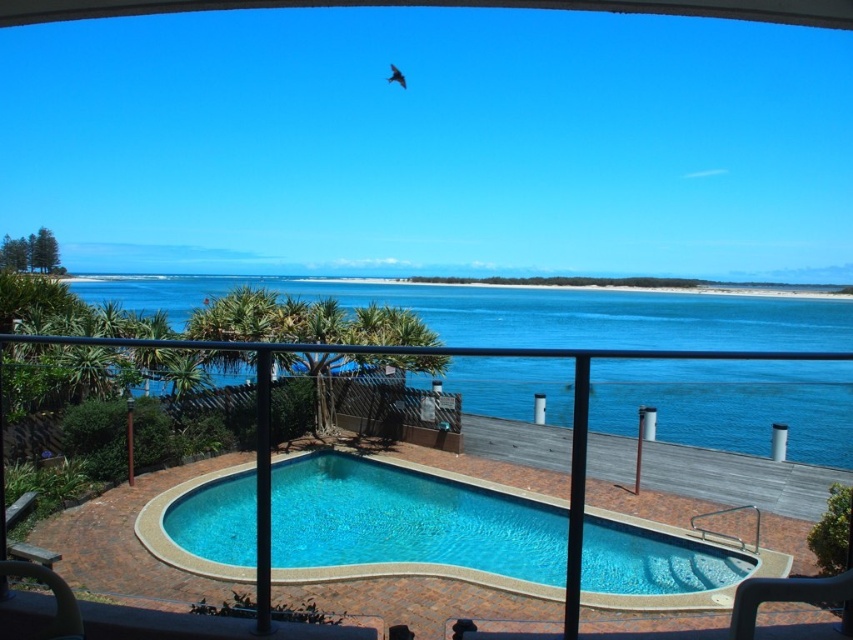
Is blue concrete pool at center positioned at the back of smooth wood deck at center?

Yes, it is behind smooth wood deck at center.

Based on the photo, between blue concrete pool at center and smooth wood deck at center, which one appears on the left side from the viewer's perspective?

smooth wood deck at center is more to the left.

I want to click on blue concrete pool at center, so click(410, 525).

At what (x,y) coordinates should I click in order to perform the action: click on blue concrete pool at center. Please return your answer as a coordinate pair (x, y). Image resolution: width=853 pixels, height=640 pixels. Looking at the image, I should click on (x=410, y=525).

In the scene shown: Does blue water at center come in front of smooth wood deck at center?

No, blue water at center is behind smooth wood deck at center.

Who is more distant from viewer, (560, 330) or (221, 346)?

Positioned behind is point (560, 330).

Where is `blue water at center`? Image resolution: width=853 pixels, height=640 pixels. blue water at center is located at coordinates (529, 310).

Is the position of blue water at center less distant than that of blue concrete pool at center?

Yes.

Does point (635, 294) come farther from viewer compared to point (144, 545)?

That is True.

Is point (595, 314) positioned before point (299, 538)?

No, (595, 314) is further to viewer.

Identify the location of blue water at center. The height and width of the screenshot is (640, 853). (529, 310).